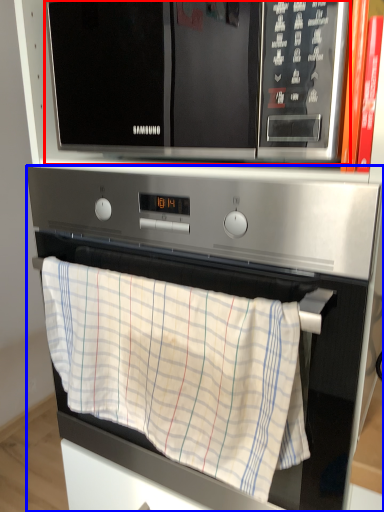
Question: Which object is closer to the camera taking this photo, microwave oven (highlighted by a red box) or oven (highlighted by a blue box)?

Choices:
 (A) microwave oven
 (B) oven

Answer: (A)